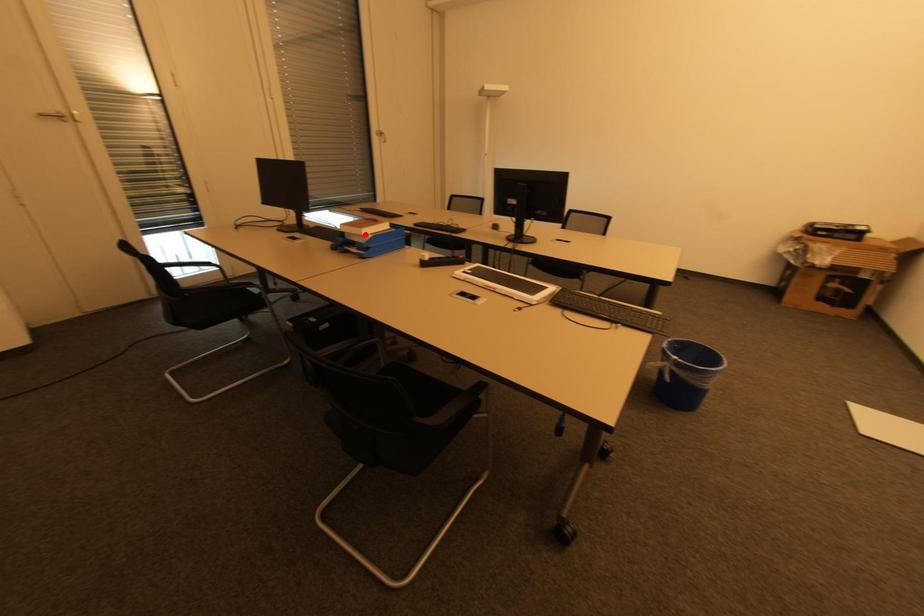
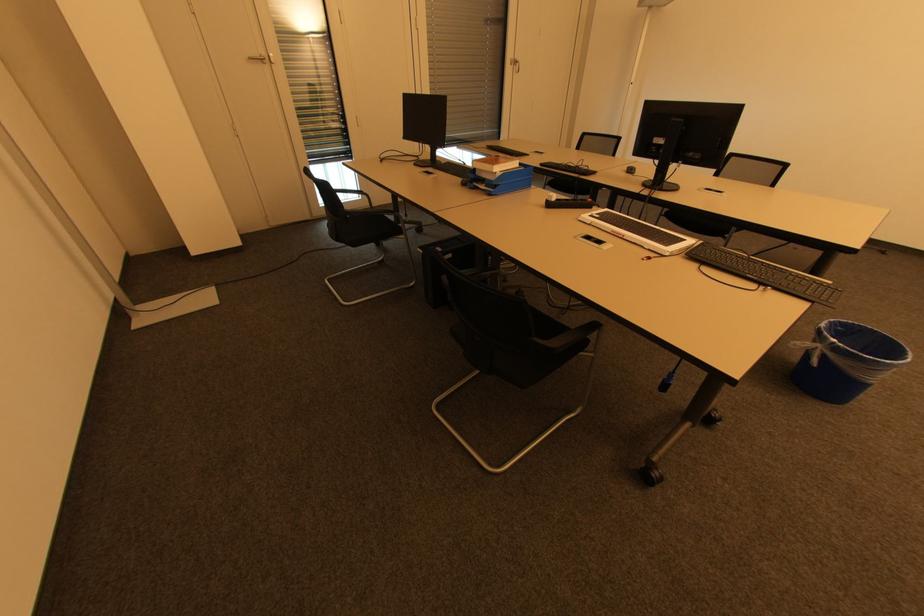
Locate, in the second image, the point that corresponds to the highlighted location in the first image.

(495, 172)